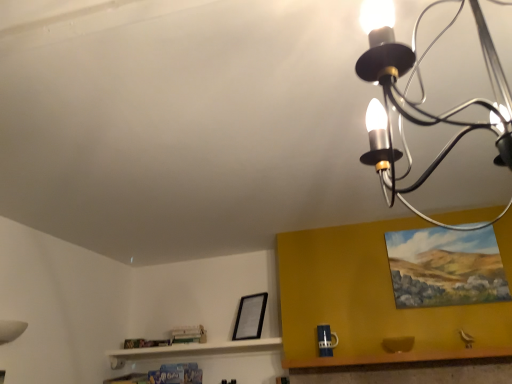
Question: From a real-world perspective, is oil painting at upper right, which is counted as the 2th picture frame, starting from the left, below black matte picture frame at lower center, the second picture frame from the front?

Choices:
 (A) yes
 (B) no

Answer: (B)

Question: Is oil painting at upper right, which ranks as the 2th picture frame in back-to-front order, bigger than black matte picture frame at lower center, the second picture frame in the top-to-bottom sequence?

Choices:
 (A) yes
 (B) no

Answer: (A)

Question: Considering the relative sizes of oil painting at upper right, placed as the 1th picture frame when sorted from top to bottom, and black matte picture frame at lower center, the 1th picture frame when ordered from left to right, in the image provided, is oil painting at upper right, placed as the 1th picture frame when sorted from top to bottom, smaller than black matte picture frame at lower center, the 1th picture frame when ordered from left to right,?

Choices:
 (A) yes
 (B) no

Answer: (B)

Question: Could you tell me if oil painting at upper right, which is counted as the 2th picture frame, starting from the left, is turned towards black matte picture frame at lower center, the 1th picture frame when ordered from left to right?

Choices:
 (A) no
 (B) yes

Answer: (A)

Question: From the image's perspective, is oil painting at upper right, which ranks as the 1th picture frame in right-to-left order, on black matte picture frame at lower center, the 1th picture frame when ordered from back to front?

Choices:
 (A) no
 (B) yes

Answer: (B)

Question: Does point click(x=239, y=307) appear closer or farther from the camera than point click(x=438, y=354)?

Choices:
 (A) closer
 (B) farther

Answer: (B)

Question: From a real-world perspective, is black matte picture frame at lower center, the 1th picture frame when ordered from left to right, above or below wooden table at lower right?

Choices:
 (A) above
 (B) below

Answer: (A)

Question: From their relative heights in the image, would you say black matte picture frame at lower center, which is counted as the 2th picture frame, starting from the right, is taller or shorter than wooden table at lower right?

Choices:
 (A) tall
 (B) short

Answer: (A)

Question: Is black matte picture frame at lower center, the 1th picture frame when ordered from back to front, wider or thinner than wooden table at lower right?

Choices:
 (A) wide
 (B) thin

Answer: (B)

Question: Based on their positions, is black matte picture frame at lower center, the 1th picture frame when ordered from back to front, located to the left or right of oil painting at upper right, which ranks as the 2th picture frame in back-to-front order?

Choices:
 (A) right
 (B) left

Answer: (B)

Question: Considering their positions, is black matte picture frame at lower center, the second picture frame from the front, located in front of or behind oil painting at upper right, which is counted as the 2th picture frame, starting from the left?

Choices:
 (A) behind
 (B) front

Answer: (A)

Question: From the image's perspective, relative to oil painting at upper right, which is counted as the 2th picture frame, starting from the left, is black matte picture frame at lower center, the 1th picture frame when ordered from back to front, above or below?

Choices:
 (A) below
 (B) above

Answer: (A)

Question: Is point (245, 339) positioned closer to the camera than point (495, 261)?

Choices:
 (A) farther
 (B) closer

Answer: (A)

Question: From their relative heights in the image, would you say black metal chandelier at upper right is taller or shorter than oil painting at upper right, placed as the 1th picture frame when sorted from top to bottom?

Choices:
 (A) tall
 (B) short

Answer: (A)

Question: Considering their positions, is black metal chandelier at upper right located in front of or behind oil painting at upper right, the second picture frame from the bottom?

Choices:
 (A) front
 (B) behind

Answer: (A)